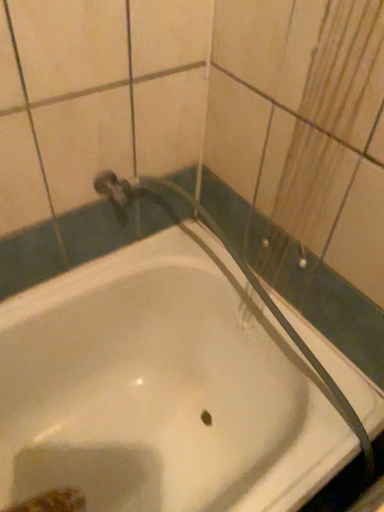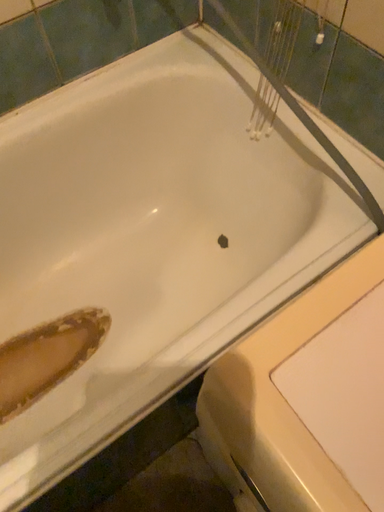
Question: Which way did the camera rotate in the video?

Choices:
 (A) rotated upward
 (B) rotated downward

Answer: (B)